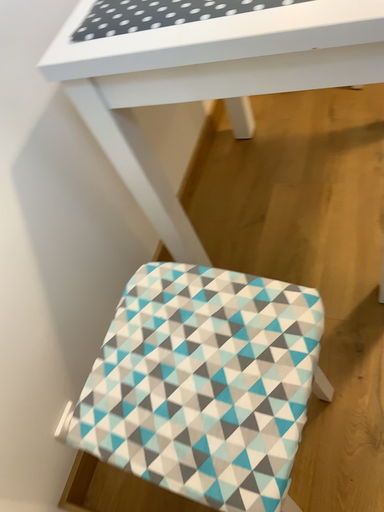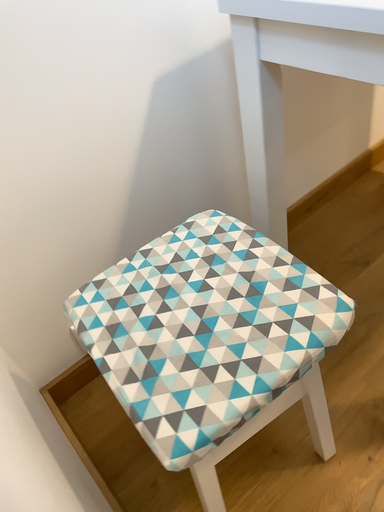
Question: Which way did the camera rotate in the video?

Choices:
 (A) rotated right
 (B) rotated left

Answer: (B)